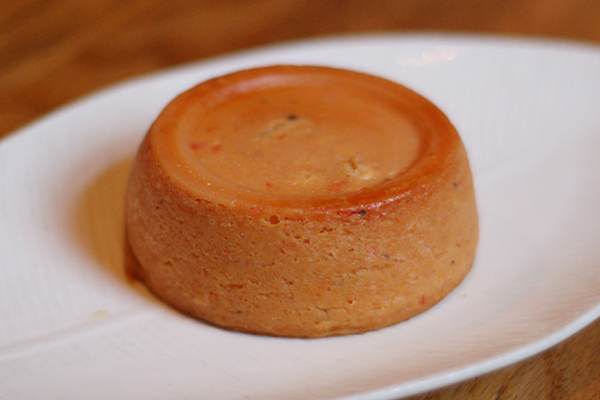
This screenshot has height=400, width=600. In order to click on plate in this screenshot , I will do `click(567, 287)`.